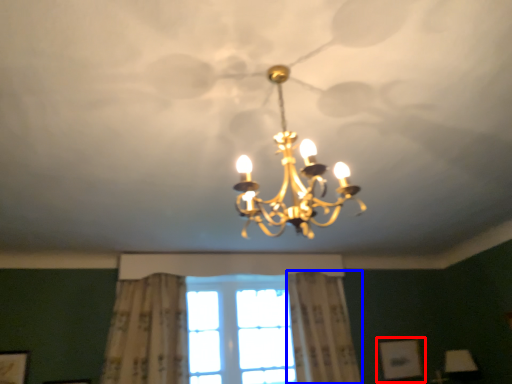
Question: Among these objects, which one is nearest to the camera, picture frame (highlighted by a red box) or curtain (highlighted by a blue box)?

Choices:
 (A) picture frame
 (B) curtain

Answer: (B)